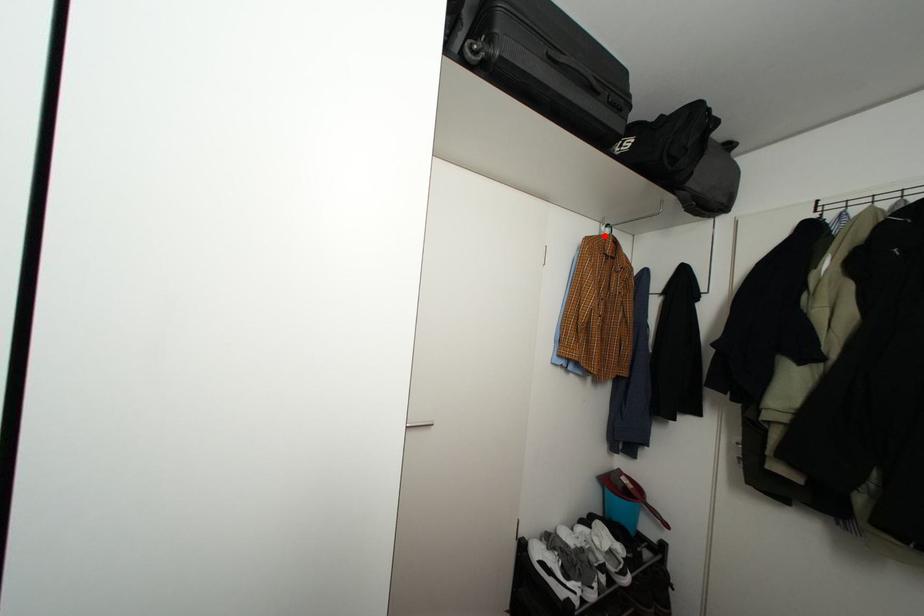
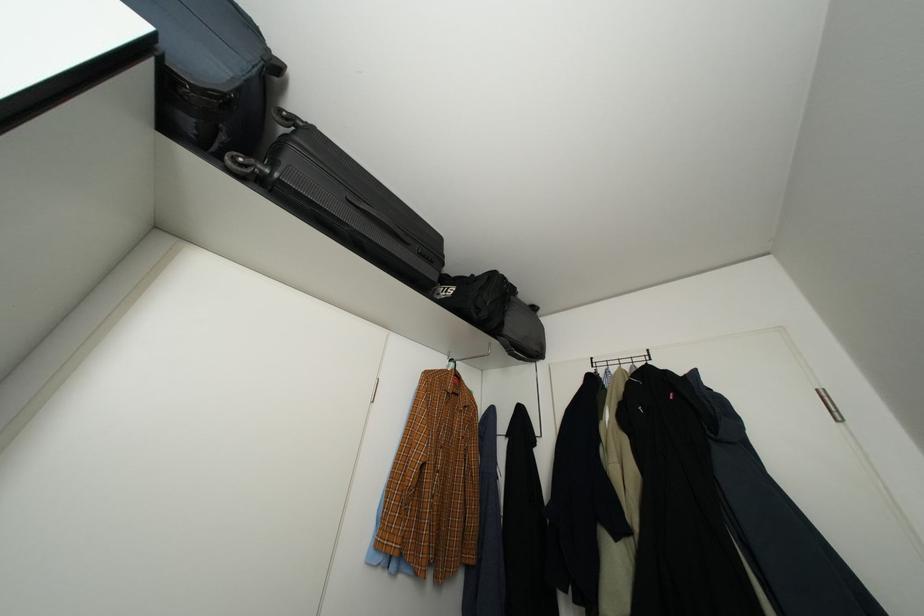
Locate, in the second image, the point that corresponds to the highlighted location in the first image.

(451, 369)